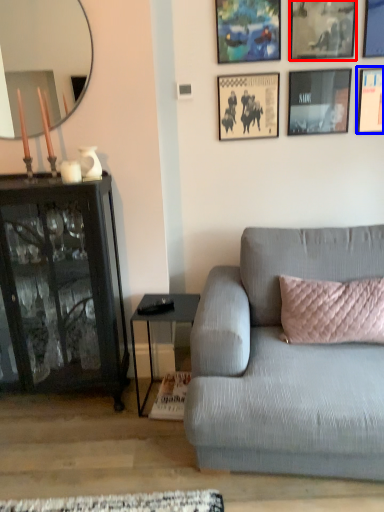
Question: Among these objects, which one is nearest to the camera, picture frame (highlighted by a red box) or picture frame (highlighted by a blue box)?

Choices:
 (A) picture frame
 (B) picture frame

Answer: (A)